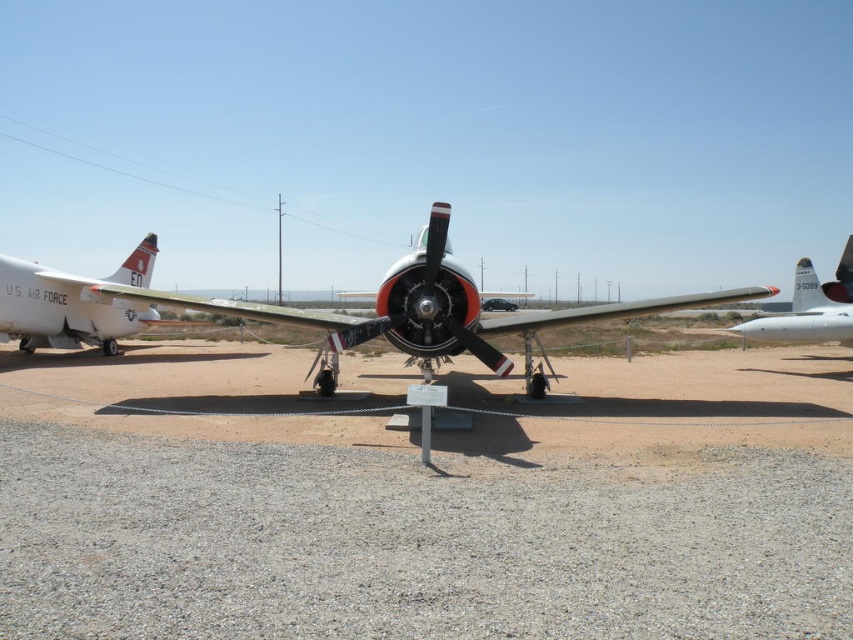
Based on the scene description, where is the metallic silver airplane at center located in terms of coordinates?

The metallic silver airplane at center is located at point coordinates of (428, 310).